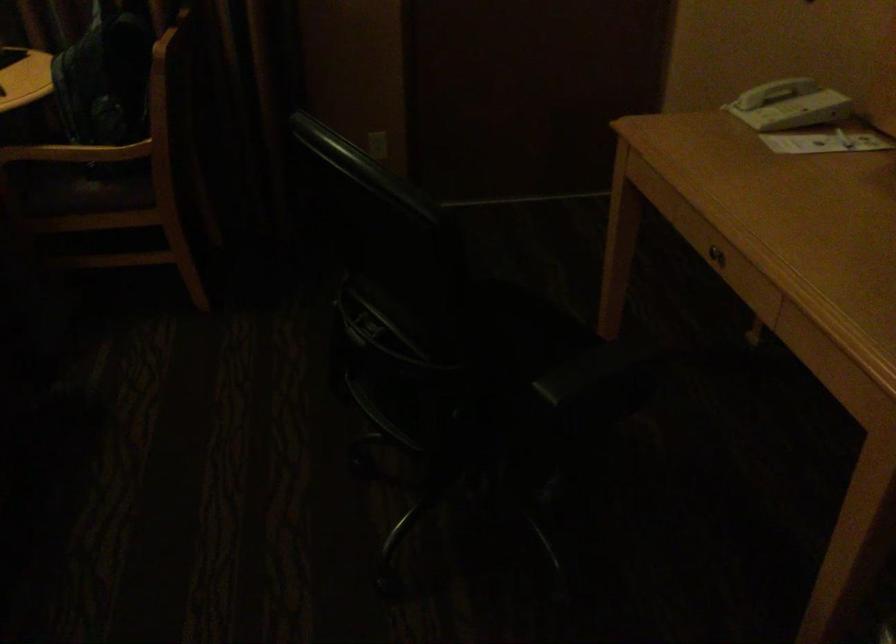
Identify the location of drawer handle. (x=714, y=257).